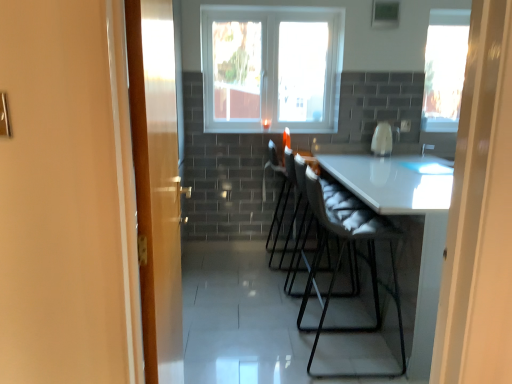
Find the location of a particular element. Image resolution: width=512 pixels, height=384 pixels. free spot below white fabric chair at center, acting as the 1th chair starting from the front (from a real-world perspective) is located at coordinates (330, 356).